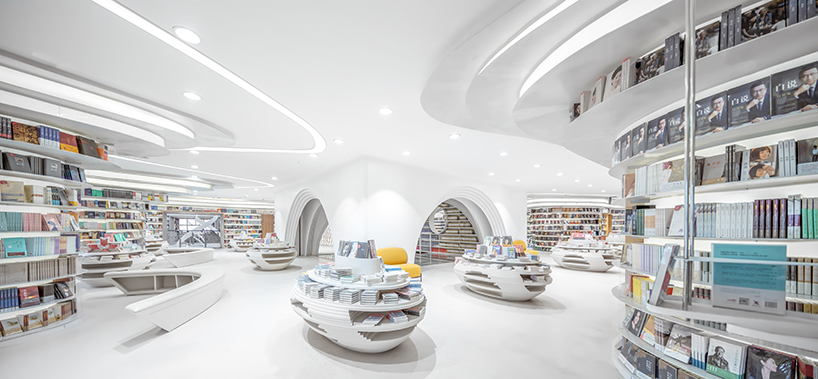
Identify the location of yellow chairs. The width and height of the screenshot is (818, 379). 398,255, 523,246.